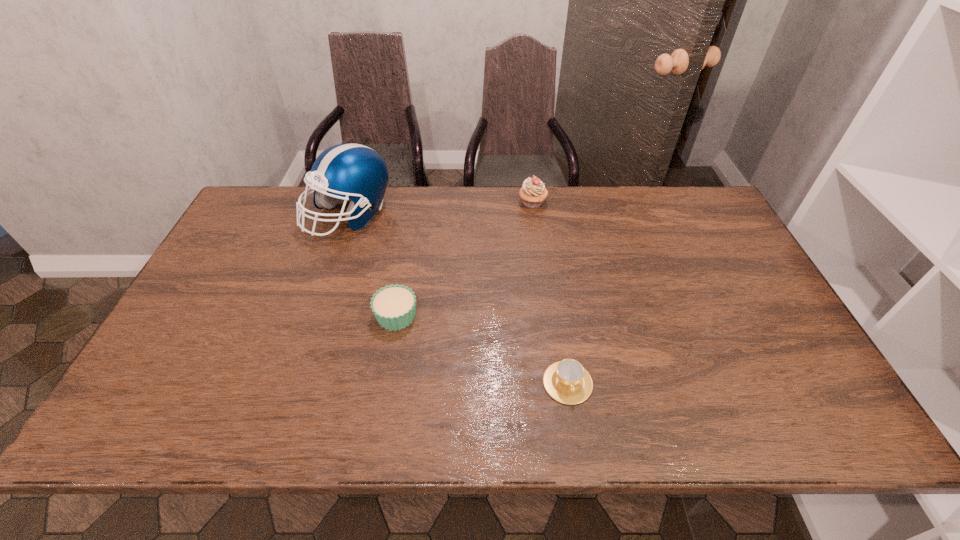
Identify the location of vacant space that's between the taller cupcake and the football helmet. (441, 209).

At what (x,y) coordinates should I click in order to perform the action: click on free space between the shorter cupcake and the second tallest object. Please return your answer as a coordinate pair (x, y). The height and width of the screenshot is (540, 960). Looking at the image, I should click on (465, 259).

Identify the location of vacant area that lies between the cup and the leftmost object. (458, 299).

What are the coordinates of `free spot between the left cupcake and the nearest object` in the screenshot? It's located at (482, 349).

Where is `vacant space in between the shortest object and the leftmost object`? vacant space in between the shortest object and the leftmost object is located at coordinates (458, 299).

Locate an element on the screen. The height and width of the screenshot is (540, 960). vacant area that lies between the second tallest object and the football helmet is located at coordinates (441, 209).

The width and height of the screenshot is (960, 540). I want to click on free space between the taller cupcake and the third farthest object, so click(465, 259).

You are a GUI agent. You are given a task and a screenshot of the screen. Output one action in this format:
    pyautogui.click(x=<x>, y=<y>)
    Task: Click on the vacant region between the cup and the third shortest object
    The image size is (960, 540).
    Given the screenshot: What is the action you would take?
    pyautogui.click(x=550, y=293)

Where is `vacant area between the taller cupcake and the nearer cupcake`? Image resolution: width=960 pixels, height=540 pixels. vacant area between the taller cupcake and the nearer cupcake is located at coordinates (465, 259).

Locate an element on the screen. The height and width of the screenshot is (540, 960). object that is the second closest to the second tallest object is located at coordinates (394, 307).